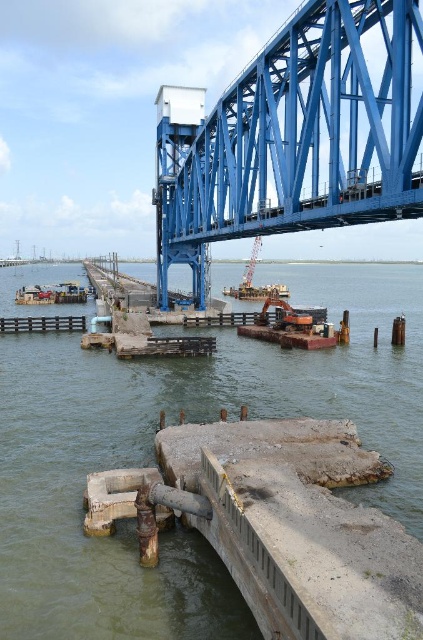
Question: Which is farther from the metallic gray crane at center?

Choices:
 (A) blue metallic bridge at upper center
 (B) gray concrete water at center

Answer: (A)

Question: Is gray concrete water at center positioned in front of blue metallic bridge at upper center?

Choices:
 (A) no
 (B) yes

Answer: (A)

Question: Estimate the real-world distances between objects in this image. Which object is closer to the metallic gray crane at center?

Choices:
 (A) gray concrete water at center
 (B) blue metallic bridge at upper center

Answer: (A)

Question: Which of the following is the farthest from the observer?

Choices:
 (A) (x=250, y=275)
 (B) (x=30, y=269)

Answer: (B)

Question: Does rustic wood dock at lower left lie in front of metallic gray crane at center?

Choices:
 (A) no
 (B) yes

Answer: (B)

Question: Does blue metallic bridge at upper center lie behind rustic wood dock at lower left?

Choices:
 (A) yes
 (B) no

Answer: (B)